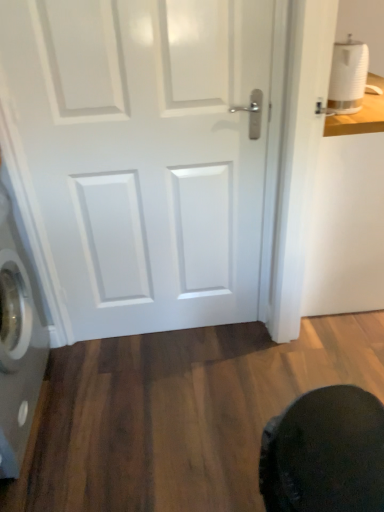
Question: Considering the relative sizes of white matte toilet paper at upper right and dark fabric swivel chair at lower right in the image provided, is white matte toilet paper at upper right shorter than dark fabric swivel chair at lower right?

Choices:
 (A) no
 (B) yes

Answer: (B)

Question: Is the position of white matte toilet paper at upper right more distant than that of dark fabric swivel chair at lower right?

Choices:
 (A) yes
 (B) no

Answer: (A)

Question: From the image's perspective, is white matte toilet paper at upper right over dark fabric swivel chair at lower right?

Choices:
 (A) no
 (B) yes

Answer: (B)

Question: Is white matte toilet paper at upper right turned away from dark fabric swivel chair at lower right?

Choices:
 (A) yes
 (B) no

Answer: (B)

Question: From a real-world perspective, is white matte toilet paper at upper right positioned over dark fabric swivel chair at lower right based on gravity?

Choices:
 (A) yes
 (B) no

Answer: (A)

Question: Does white matte toilet paper at upper right touch dark fabric swivel chair at lower right?

Choices:
 (A) yes
 (B) no

Answer: (B)

Question: Does white glossy door at center appear on the right side of dark fabric swivel chair at lower right?

Choices:
 (A) no
 (B) yes

Answer: (A)

Question: Is white glossy door at center taller than dark fabric swivel chair at lower right?

Choices:
 (A) no
 (B) yes

Answer: (B)

Question: Can you confirm if white glossy door at center is wider than dark fabric swivel chair at lower right?

Choices:
 (A) no
 (B) yes

Answer: (A)

Question: Is dark fabric swivel chair at lower right located within white glossy door at center?

Choices:
 (A) no
 (B) yes

Answer: (A)

Question: Is white glossy door at center looking in the opposite direction of dark fabric swivel chair at lower right?

Choices:
 (A) yes
 (B) no

Answer: (B)

Question: From the image's perspective, is white glossy door at center over dark fabric swivel chair at lower right?

Choices:
 (A) yes
 (B) no

Answer: (A)

Question: Does silver metallic washing machine at left appear on the right side of dark fabric swivel chair at lower right?

Choices:
 (A) yes
 (B) no

Answer: (B)